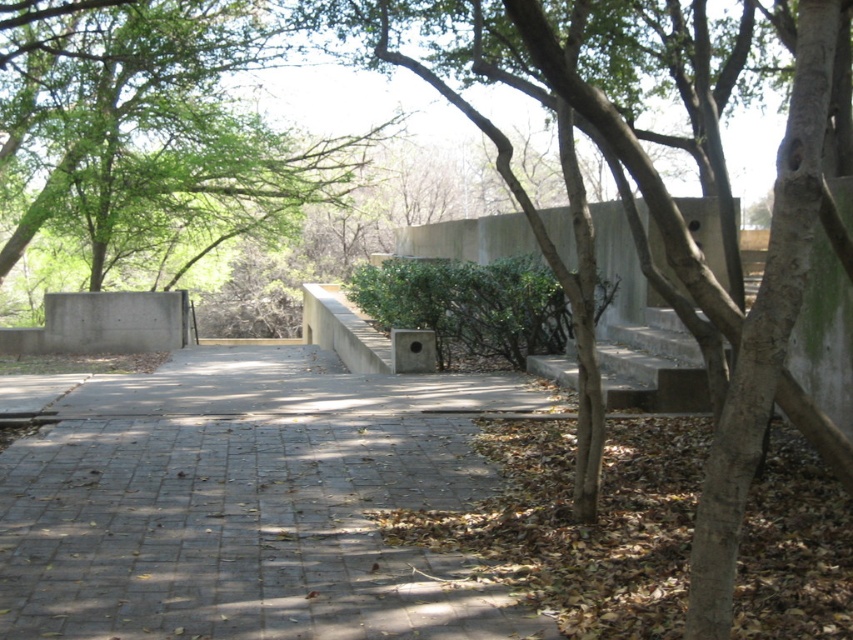
Question: Which object appears farthest from the camera in this image?

Choices:
 (A) gray concrete pavement at center
 (B) green matte hedge at center

Answer: (B)

Question: Observing the image, what is the correct spatial positioning of green leafy tree at center in reference to green matte hedge at center?

Choices:
 (A) right
 (B) left

Answer: (B)

Question: Does gray concrete pavement at center appear on the left side of green matte hedge at center?

Choices:
 (A) yes
 (B) no

Answer: (A)

Question: Based on their relative distances, which object is farther from the green leafy tree at center?

Choices:
 (A) green matte hedge at center
 (B) gray concrete pavement at center

Answer: (B)

Question: Which is farther from the green matte hedge at center?

Choices:
 (A) green leafy tree at center
 (B) gray concrete pavement at center

Answer: (A)

Question: Is green leafy tree at center to the right of green matte hedge at center from the viewer's perspective?

Choices:
 (A) yes
 (B) no

Answer: (B)